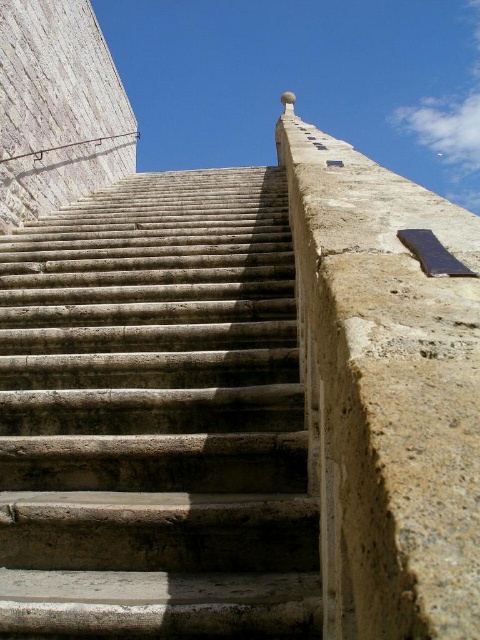
You are standing on the gray stone stairs at center and want to reach the smooth beige concrete at right. According to the scene, which direction should you move to get there?

The gray stone stairs at center is located below the smooth beige concrete at right, so you should move upwards to reach the smooth beige concrete at right.

You are a construction worker assessing the stability of the stairs. You notice two areas of smooth beige concrete at right and smooth beige concrete at upper left. Which area requires more material for repair based on their sizes?

The smooth beige concrete at right requires more material for repair since it is bigger than the smooth beige concrete at upper left.

From the picture: You are standing at the bottom of the stairs and want to walk towards the smooth beige concrete at upper left. Which direction should you turn to avoid the smooth beige concrete at right?

The smooth beige concrete at right is positioned on the right side of smooth beige concrete at upper left. To avoid it, turn left towards the smooth beige concrete at upper left.